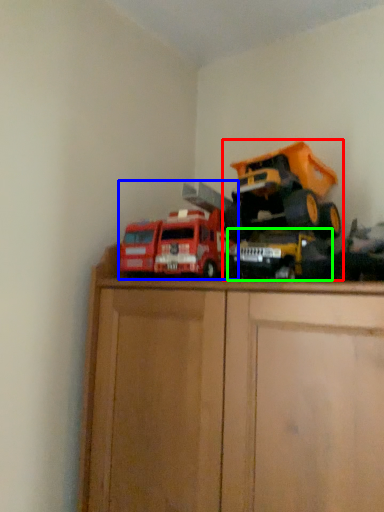
Question: Which object is positioned closest to toy (highlighted by a red box)? Select from toy (highlighted by a blue box) and toy (highlighted by a green box).

Choices:
 (A) toy
 (B) toy

Answer: (B)